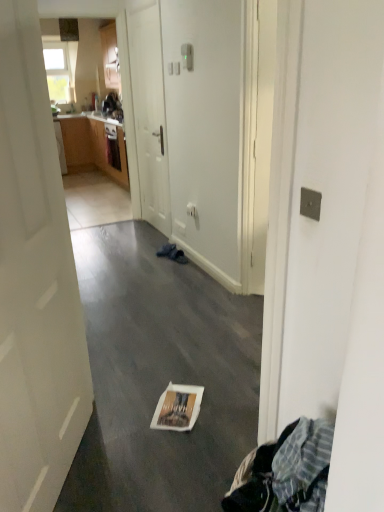
Where is `vacant region to the right of white glossy magazine at center`? This screenshot has width=384, height=512. vacant region to the right of white glossy magazine at center is located at coordinates (218, 402).